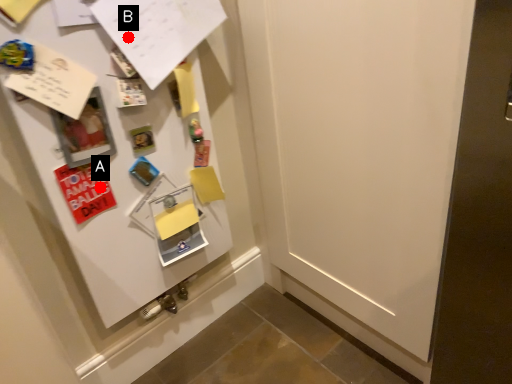
Question: Two points are circled on the image, labeled by A and B beside each circle. Which point is closer to the camera taking this photo?

Choices:
 (A) A is closer
 (B) B is closer

Answer: (B)